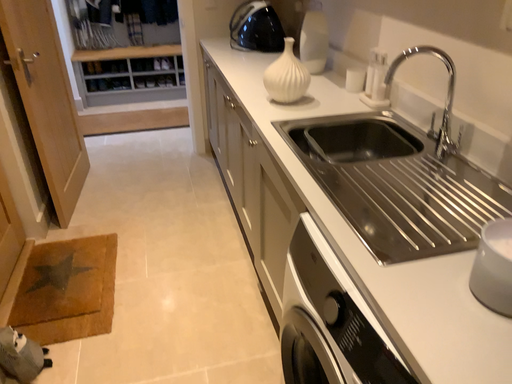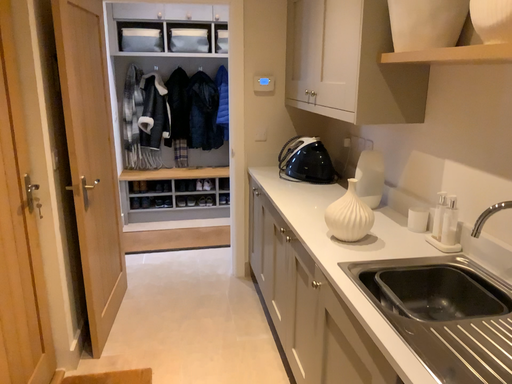
Question: Which way did the camera rotate in the video?

Choices:
 (A) rotated upward
 (B) rotated downward

Answer: (A)